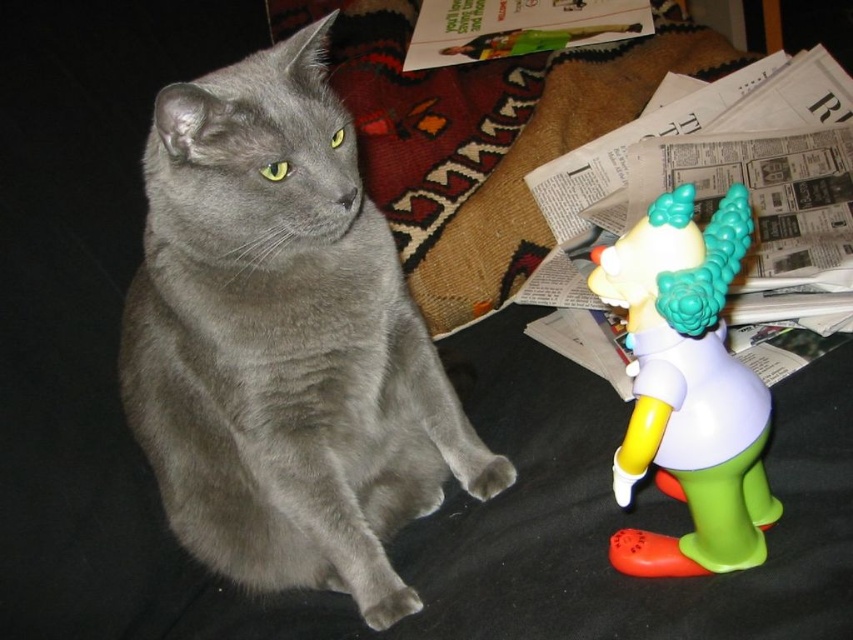
Question: Which point is farther to the camera?

Choices:
 (A) (733, 452)
 (B) (288, 161)

Answer: (B)

Question: Can you confirm if matte gray cat at center is thinner than matte plastic unicorn at right?

Choices:
 (A) yes
 (B) no

Answer: (B)

Question: Where is matte gray cat at center located in relation to matte plastic unicorn at right in the image?

Choices:
 (A) right
 (B) left

Answer: (B)

Question: Does matte gray cat at center appear on the right side of matte plastic unicorn at right?

Choices:
 (A) no
 (B) yes

Answer: (A)